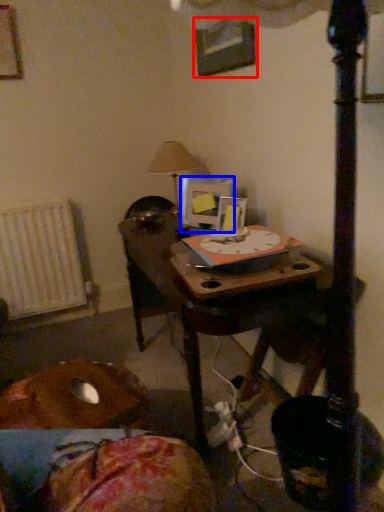
Question: Which object is closer to the camera taking this photo, picture frame (highlighted by a red box) or picture frame (highlighted by a blue box)?

Choices:
 (A) picture frame
 (B) picture frame

Answer: (A)